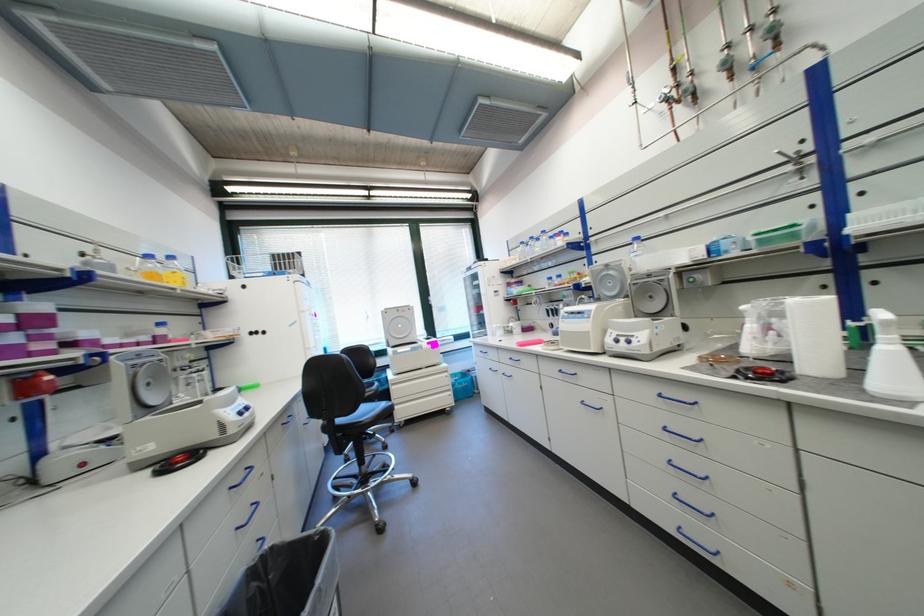
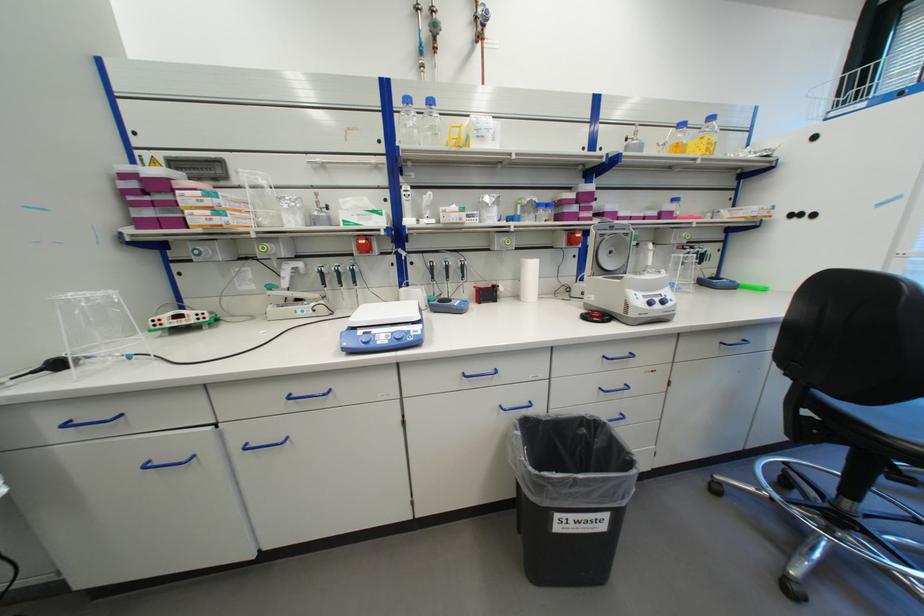
Find the pixel in the second image that matches [247,419] in the first image.

(652, 307)